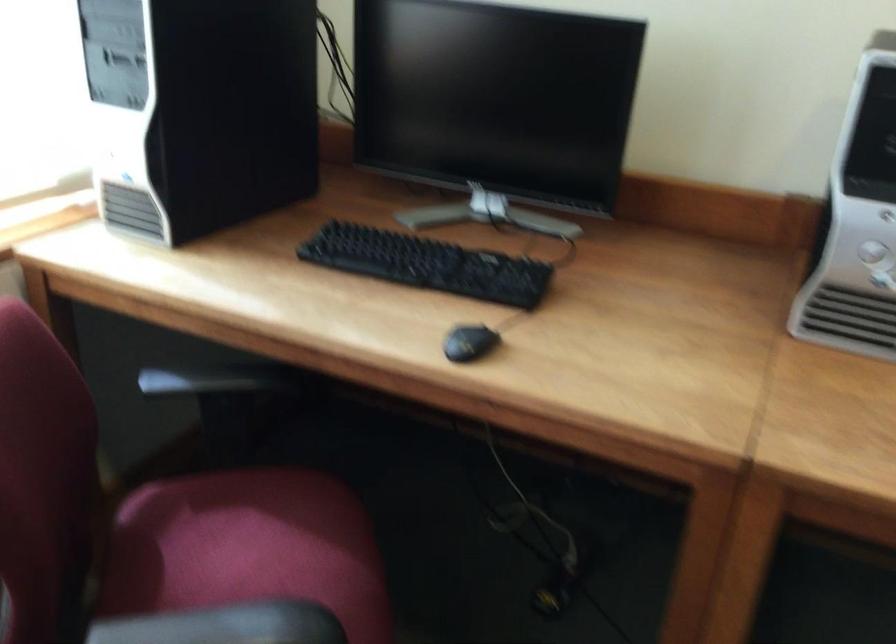
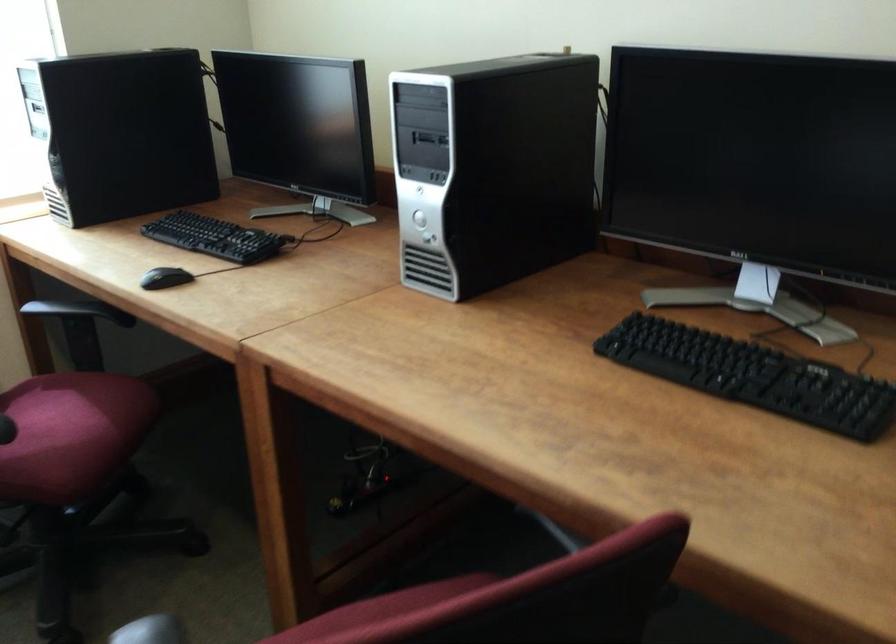
Find the pixel in the second image that matches pixel 474 342 in the first image.

(165, 278)